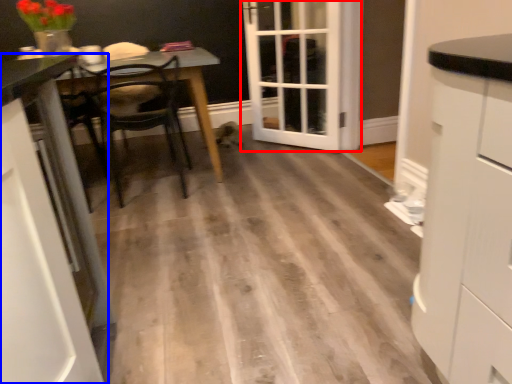
Question: Which of the following is the closest to the observer, door (highlighted by a red box) or cabinetry (highlighted by a blue box)?

Choices:
 (A) door
 (B) cabinetry

Answer: (B)